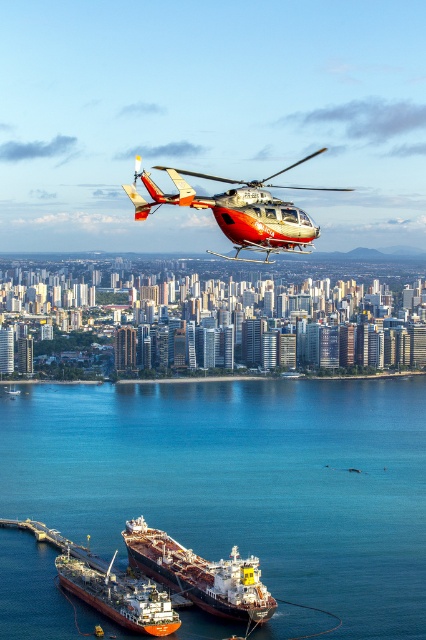
You are a drone pilot navigating through the city. You see two points in the sky marked as point (210, 252) and point (134, 584). Which point is closer to your current position if you are directly above the police helicopter?

Point (210, 252) is in front of point (134, 584), so it is closer to your current position above the police helicopter.

You are a pilot flying the metallic silver helicopter at center and need to land on the red matte tanker ship at lower center. Which direction should you move to get closer to the ship?

The metallic silver helicopter at center is currently closer to the viewer than the red matte tanker ship at lower center. To get closer to the ship, you should move downward towards it.